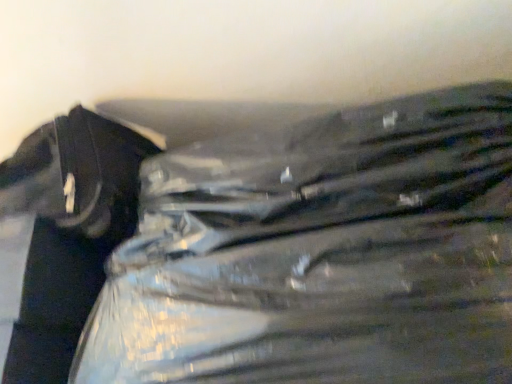
Question: Is metallic silver zipper at left inside transparent plastic bag at center?

Choices:
 (A) yes
 (B) no

Answer: (B)

Question: From a real-world perspective, is transparent plastic bag at center below metallic silver zipper at left?

Choices:
 (A) yes
 (B) no

Answer: (A)

Question: Is transparent plastic bag at center directly adjacent to metallic silver zipper at left?

Choices:
 (A) no
 (B) yes

Answer: (A)

Question: From the image's perspective, is transparent plastic bag at center below metallic silver zipper at left?

Choices:
 (A) yes
 (B) no

Answer: (B)

Question: Does transparent plastic bag at center have a greater height compared to metallic silver zipper at left?

Choices:
 (A) yes
 (B) no

Answer: (B)

Question: Considering the relative sizes of transparent plastic bag at center and metallic silver zipper at left in the image provided, is transparent plastic bag at center shorter than metallic silver zipper at left?

Choices:
 (A) no
 (B) yes

Answer: (B)

Question: From the image's perspective, is metallic silver zipper at left above transparent plastic bag at center?

Choices:
 (A) yes
 (B) no

Answer: (B)

Question: Considering the relative sizes of metallic silver zipper at left and transparent plastic bag at center in the image provided, is metallic silver zipper at left wider than transparent plastic bag at center?

Choices:
 (A) no
 (B) yes

Answer: (A)

Question: Is metallic silver zipper at left oriented towards transparent plastic bag at center?

Choices:
 (A) no
 (B) yes

Answer: (A)

Question: Is metallic silver zipper at left surrounding transparent plastic bag at center?

Choices:
 (A) yes
 (B) no

Answer: (B)

Question: From the image's perspective, is metallic silver zipper at left below transparent plastic bag at center?

Choices:
 (A) no
 (B) yes

Answer: (B)

Question: Is metallic silver zipper at left closer to the viewer compared to transparent plastic bag at center?

Choices:
 (A) yes
 (B) no

Answer: (B)

Question: Considering the relative positions of metallic silver zipper at left and transparent plastic bag at center in the image provided, is metallic silver zipper at left to the left or to the right of transparent plastic bag at center?

Choices:
 (A) right
 (B) left

Answer: (B)